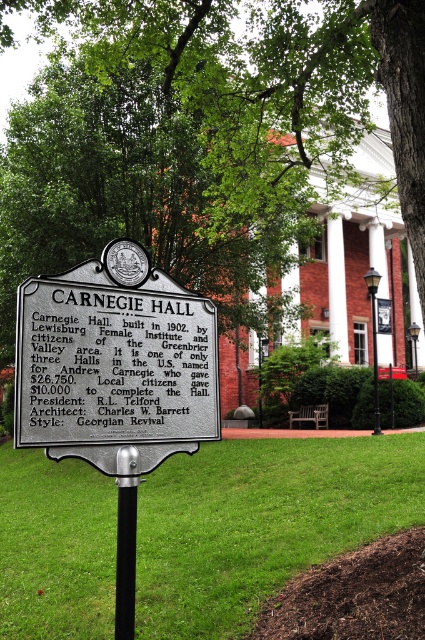
Question: Which of the following is the closest to the observer?

Choices:
 (A) (x=192, y=369)
 (B) (x=238, y=42)
 (C) (x=223, y=445)

Answer: (A)

Question: Can you confirm if green leafy tree at upper center is thinner than black metal pole at center?

Choices:
 (A) yes
 (B) no

Answer: (B)

Question: Which object is positioned farthest from the black metal pole at center?

Choices:
 (A) green leafy tree at upper center
 (B) green grass at center
 (C) silver metallic sign at center-left

Answer: (A)

Question: Which point is farther to the camera?

Choices:
 (A) pyautogui.click(x=129, y=449)
 (B) pyautogui.click(x=204, y=392)
 (C) pyautogui.click(x=227, y=502)
 (D) pyautogui.click(x=124, y=214)

Answer: (D)

Question: Is green leafy tree at upper center thinner than black metal pole at center?

Choices:
 (A) no
 (B) yes

Answer: (A)

Question: Is green grass at center positioned in front of silver metallic sign at center-left?

Choices:
 (A) yes
 (B) no

Answer: (B)